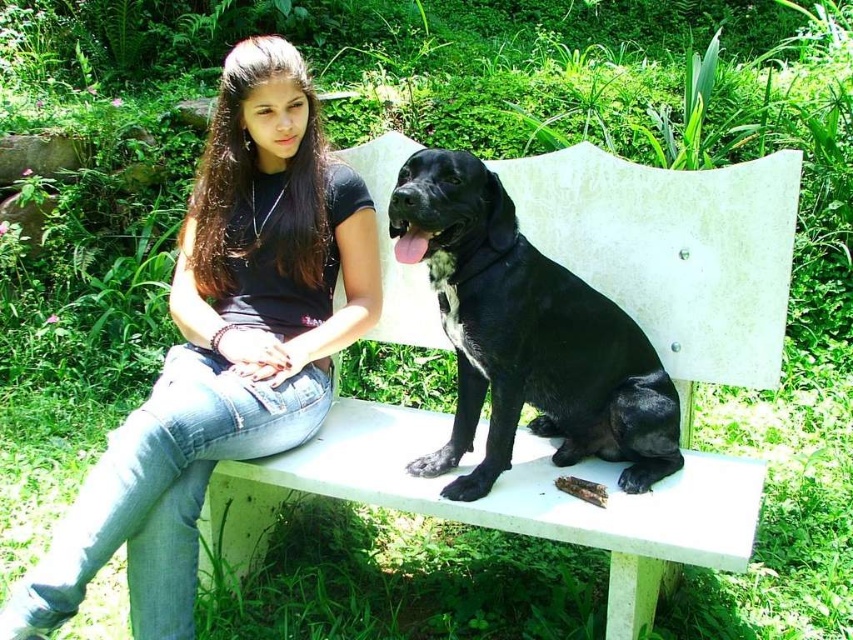
Is white matte park bench at center smaller than black matte shirt at upper center?

No.

Is white matte park bench at center positioned behind black matte shirt at upper center?

That is False.

Does point (409, 442) come in front of point (262, 278)?

Yes, point (409, 442) is in front of point (262, 278).

The width and height of the screenshot is (853, 640). Identify the location of white matte park bench at center. (674, 252).

How distant is black matte shirt at upper center from black smooth dog at center?

A distance of 21.96 inches exists between black matte shirt at upper center and black smooth dog at center.

Does black matte shirt at upper center have a lesser height compared to black smooth dog at center?

In fact, black matte shirt at upper center may be taller than black smooth dog at center.

You are a GUI agent. You are given a task and a screenshot of the screen. Output one action in this format:
    pyautogui.click(x=<x>, y=<y>)
    Task: Click on the black matte shirt at upper center
    Image resolution: width=853 pixels, height=640 pixels.
    Given the screenshot: What is the action you would take?
    pyautogui.click(x=223, y=346)

This screenshot has height=640, width=853. What are the coordinates of `black matte shirt at upper center` in the screenshot? It's located at (223, 346).

Which of these two, white matte park bench at center or black smooth dog at center, stands taller?

white matte park bench at center

Is white matte park bench at center thinner than black smooth dog at center?

Incorrect, white matte park bench at center's width is not less than black smooth dog at center's.

Who is more distant from viewer, (618, 291) or (462, 294)?

Positioned behind is point (618, 291).

You are a GUI agent. You are given a task and a screenshot of the screen. Output one action in this format:
    pyautogui.click(x=<x>, y=<y>)
    Task: Click on the white matte park bench at center
    
    Given the screenshot: What is the action you would take?
    pyautogui.click(x=674, y=252)